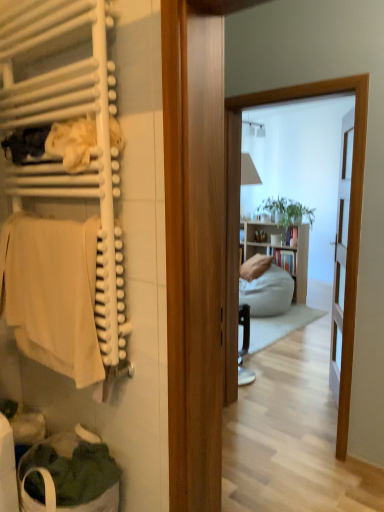
Identify the location of white matte towel rack at left. The image size is (384, 512). (66, 197).

This screenshot has width=384, height=512. In order to click on white fabric laundry basket at lower left in this screenshot , I will do `click(69, 475)`.

The image size is (384, 512). Describe the element at coordinates (69, 475) in the screenshot. I see `white fabric laundry basket at lower left` at that location.

At what (x,y) coordinates should I click in order to perform the action: click on beige cotton towel at left. Please return your answer as a coordinate pair (x, y). The height and width of the screenshot is (512, 384). Looking at the image, I should click on (52, 293).

Is white matte towel rack at left facing towards beige cotton towel at left?

Yes, white matte towel rack at left is aimed at beige cotton towel at left.

From the image's perspective, between white matte towel rack at left and beige cotton towel at left, which one is located above?

white matte towel rack at left appears higher in the image.

Is white matte towel rack at left touching beige cotton towel at left?

Yes, the surface of white matte towel rack at left is in contact with beige cotton towel at left.

Which object is positioned more to the right, white matte towel rack at left or white fabric laundry basket at lower left?

From the viewer's perspective, white fabric laundry basket at lower left appears more on the right side.

Identify the location of closet on the left of the white fabric laundry basket at lower left. (66, 197).

Does point (38, 343) lie behind point (102, 467)?

Yes, point (38, 343) is farther from viewer.

From a real-world perspective, who is located lower, white matte towel rack at left or white fabric laundry basket at lower left?

From a 3D spatial view, white fabric laundry basket at lower left is below.

From the image's perspective, relative to white matte towel rack at left, is white fabric laundry basket at lower left above or below?

white fabric laundry basket at lower left is below white matte towel rack at left.

Measure the distance from white fabric laundry basket at lower left to white matte towel rack at left.

white fabric laundry basket at lower left and white matte towel rack at left are 24.15 inches apart.

Which point is more distant from viewer, [66,462] or [74,375]?

The point [66,462] is farther from the camera.

Is white fabric laundry basket at lower left in contact with white matte towel rack at left?

No, white fabric laundry basket at lower left is not in contact with white matte towel rack at left.

Considering the positions of objects white fabric laundry basket at lower left and beige cotton towel at left in the image provided, who is more to the right, white fabric laundry basket at lower left or beige cotton towel at left?

Positioned to the right is white fabric laundry basket at lower left.

Is white fabric laundry basket at lower left thinner than beige cotton towel at left?

No.

Is white fabric laundry basket at lower left situated inside beige cotton towel at left or outside?

The correct answer is: outside.

Where is `bath towel in front of the white fabric laundry basket at lower left`? bath towel in front of the white fabric laundry basket at lower left is located at coordinates (52, 293).

In terms of height, does beige cotton towel at left look taller or shorter compared to white matte towel rack at left?

In the image, beige cotton towel at left appears to be shorter than white matte towel rack at left.

Consider the image. Between beige cotton towel at left and white matte towel rack at left, which one has smaller width?

beige cotton towel at left.

Find the location of `closet on the right of the beige cotton towel at left`. closet on the right of the beige cotton towel at left is located at coordinates (66, 197).

Can you tell me how much beige cotton towel at left and white fabric laundry basket at lower left differ in facing direction?

There is a 88.4-degree angle between the facing directions of beige cotton towel at left and white fabric laundry basket at lower left.

Between beige cotton towel at left and white fabric laundry basket at lower left, which one has less height?

With less height is white fabric laundry basket at lower left.

Image resolution: width=384 pixels, height=512 pixels. Identify the location of bath towel in front of the white fabric laundry basket at lower left. [52, 293].

Considering the positions of points (66, 361) and (97, 462), is point (66, 361) farther from camera compared to point (97, 462)?

No, (66, 361) is in front of (97, 462).

Where is `closet located above the beige cotton towel at left (from the image's perspective)`? Image resolution: width=384 pixels, height=512 pixels. closet located above the beige cotton towel at left (from the image's perspective) is located at coordinates (66, 197).

In order to click on laundry basket behind the white matte towel rack at left in this screenshot , I will do `click(69, 475)`.

Based on their spatial positions, is white fabric laundry basket at lower left or white matte towel rack at left further from beige cotton towel at left?

Based on the image, white fabric laundry basket at lower left appears to be further to beige cotton towel at left.

From the image, which object appears to be farther from white fabric laundry basket at lower left, white matte towel rack at left or beige cotton towel at left?

The object further to white fabric laundry basket at lower left is white matte towel rack at left.

Estimate the real-world distances between objects in this image. Which object is further from white matte towel rack at left, white fabric laundry basket at lower left or beige cotton towel at left?

Among the two, white fabric laundry basket at lower left is located further to white matte towel rack at left.

Estimate the real-world distances between objects in this image. Which object is closer to white matte towel rack at left, beige cotton towel at left or white fabric laundry basket at lower left?

beige cotton towel at left is positioned closer to the anchor white matte towel rack at left.

Considering their positions, is white matte towel rack at left positioned closer to beige cotton towel at left than white fabric laundry basket at lower left?

white matte towel rack at left lies closer to beige cotton towel at left than the other object.

Looking at the image, which one is located closer to white fabric laundry basket at lower left, beige cotton towel at left or white matte towel rack at left?

beige cotton towel at left is closer to white fabric laundry basket at lower left.

Find the location of a particular element. The image size is (384, 512). bath towel between white matte towel rack at left and white fabric laundry basket at lower left vertically is located at coordinates (52, 293).